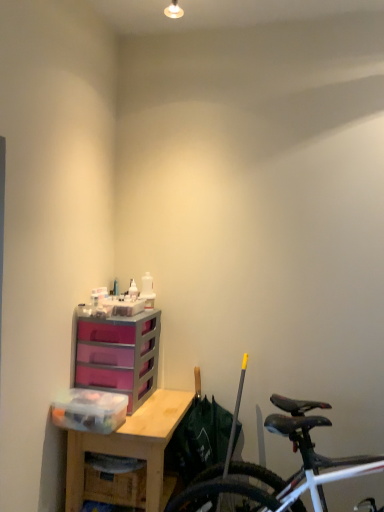
Locate an element on the screen. The width and height of the screenshot is (384, 512). vacant space to the right of purple plastic chest of drawers at center is located at coordinates (165, 400).